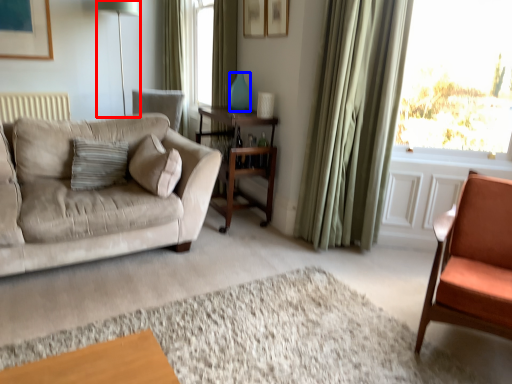
Question: Among these objects, which one is nearest to the camera, table lamp (highlighted by a red box) or vase (highlighted by a blue box)?

Choices:
 (A) table lamp
 (B) vase

Answer: (B)